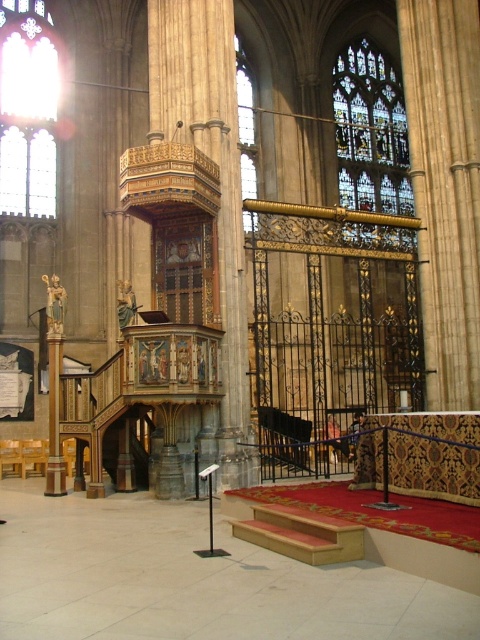
You are an architect examining the cathedral and want to install a new light fixture. The clear stained glass at upper left and the clear stained glass at upper center are both potential locations. Which stained glass is positioned higher up in the cathedral?

The clear stained glass at upper left is located above the clear stained glass at upper center, so it is positioned higher up in the cathedral.